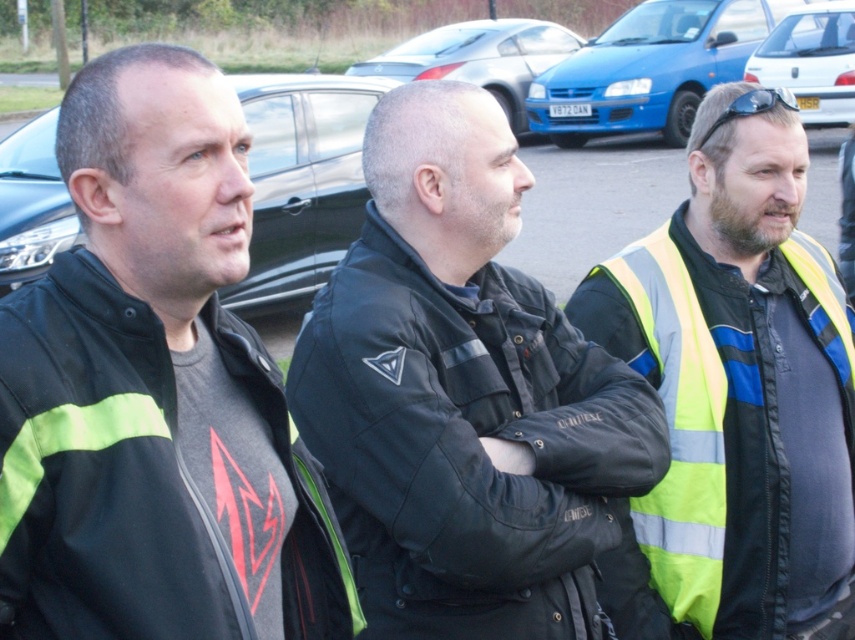
Question: Can you confirm if reflective yellow vest at center is positioned below blue matte hatchback at center?

Choices:
 (A) yes
 (B) no

Answer: (A)

Question: Does black matte car at center have a lesser width compared to blue matte hatchback at center?

Choices:
 (A) yes
 (B) no

Answer: (A)

Question: Among these objects, which one is farthest from the camera?

Choices:
 (A) blue matte hatchback at center
 (B) reflective yellow vest at center
 (C) black plastic sunglasses at upper right
 (D) blue metallic hatchback at center

Answer: (A)

Question: Does metallic silver car at center have a smaller size compared to blue metallic hatchback at center?

Choices:
 (A) yes
 (B) no

Answer: (B)

Question: Which point appears farthest from the camera in this image?

Choices:
 (A) (516, 570)
 (B) (770, 308)

Answer: (B)

Question: Estimate the real-world distances between objects in this image. Which object is farther from the metallic silver car at center?

Choices:
 (A) reflective yellow vest at center
 (B) black plastic sunglasses at upper right
 (C) black matte car at center

Answer: (B)